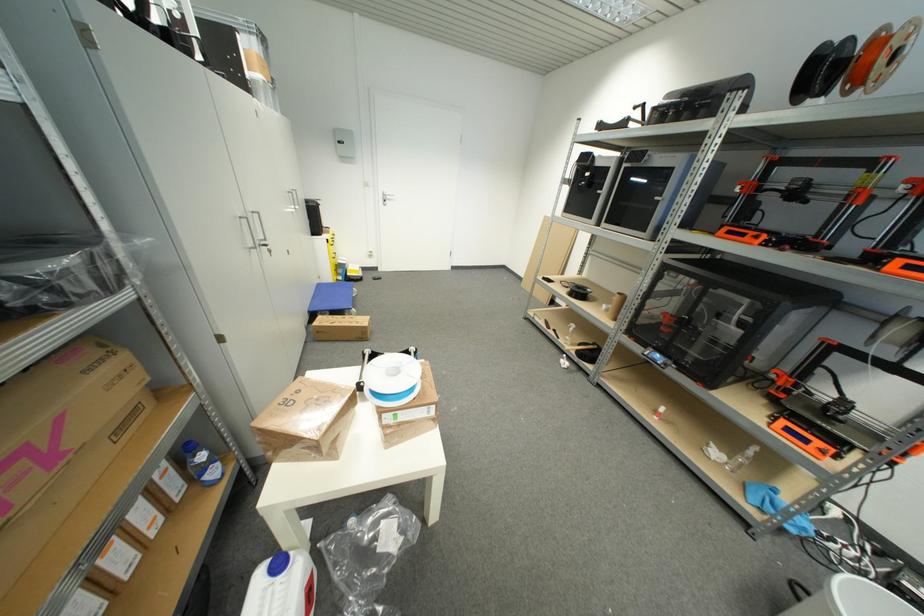
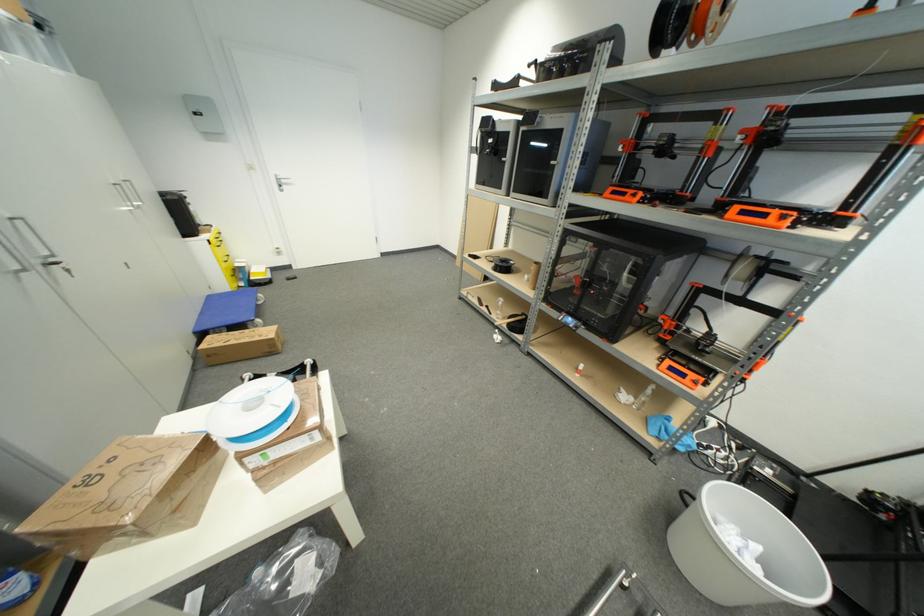
Question: Based on the continuous images, in which direction is the camera rotating? Reply with the corresponding letter.

Choices:
 (A) Left
 (B) Right
 (C) Up
 (D) Down

Answer: (B)